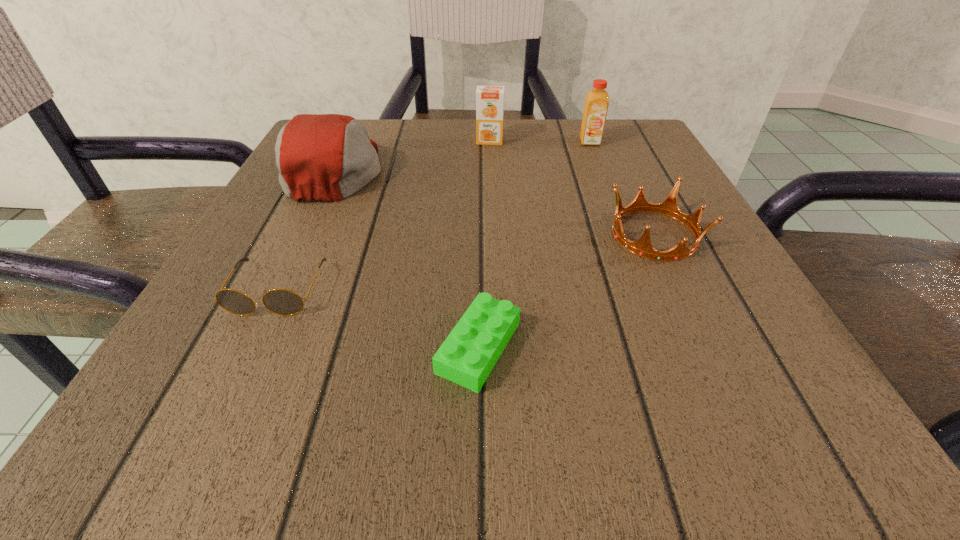
Find the location of a particular element. The width and height of the screenshot is (960, 540). free space that satisfies the following two spatial constraints: 1. on the front-facing side of the cap; 2. on the lenses of the sunglasses is located at coordinates (278, 290).

Image resolution: width=960 pixels, height=540 pixels. I want to click on vacant space that satisfies the following two spatial constraints: 1. on the front and back of the right orange juice; 2. on the front-facing side of the cap, so click(x=601, y=170).

Identify the location of free space that satisfies the following two spatial constraints: 1. on the back side of the shortest object; 2. on the right side of the third nearest object. The height and width of the screenshot is (540, 960). (479, 234).

You are a GUI agent. You are given a task and a screenshot of the screen. Output one action in this format:
    pyautogui.click(x=<x>, y=<y>)
    Task: Click on the vacant position in the image that satisfies the following two spatial constraints: 1. on the front-facing side of the cap; 2. on the right side of the shortest object
    
    Given the screenshot: What is the action you would take?
    pyautogui.click(x=252, y=347)

The width and height of the screenshot is (960, 540). Identify the location of vacant area that satisfies the following two spatial constraints: 1. on the front side of the left orange juice; 2. on the left side of the crown. coord(492,234).

Find the location of a particular element. This screenshot has width=960, height=540. free space in the image that satisfies the following two spatial constraints: 1. on the back side of the left orange juice; 2. on the left side of the Lego is located at coordinates (479, 141).

Find the location of a particular element. vacant space that satisfies the following two spatial constraints: 1. on the front side of the left orange juice; 2. on the front-facing side of the cap is located at coordinates (491, 170).

The height and width of the screenshot is (540, 960). What are the coordinates of `free region that satisfies the following two spatial constraints: 1. on the front and back of the right orange juice; 2. on the front-facing side of the cap` in the screenshot? It's located at point(601,170).